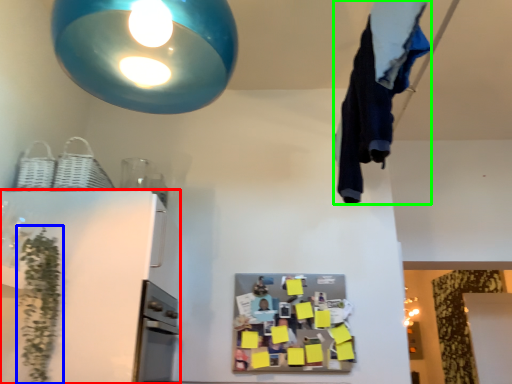
Question: Estimate the real-world distances between objects in this image. Which object is farther from appliance (highlighted by a red box), plant (highlighted by a blue box) or laundry (highlighted by a green box)?

Choices:
 (A) plant
 (B) laundry

Answer: (B)